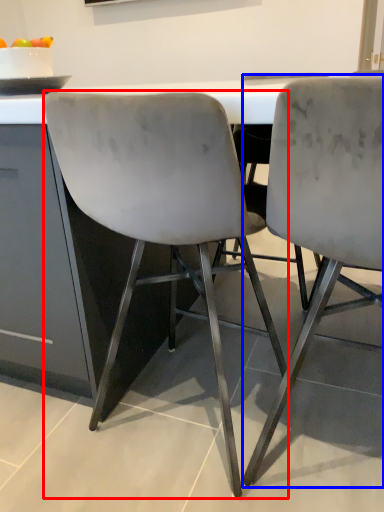
Question: Which point is closer to the camera, chair (highlighted by a red box) or chair (highlighted by a blue box)?

Choices:
 (A) chair
 (B) chair

Answer: (B)